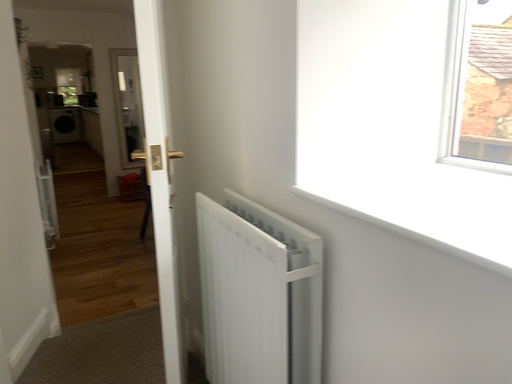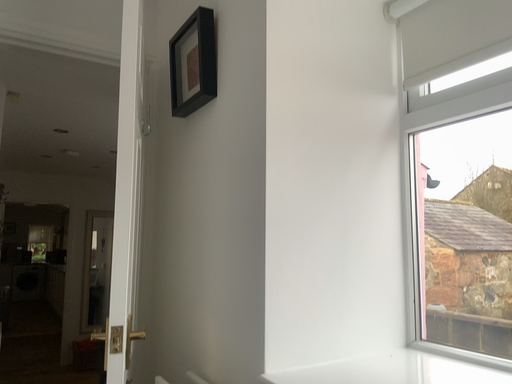
Question: How did the camera likely rotate when shooting the video?

Choices:
 (A) rotated upward
 (B) rotated downward

Answer: (A)